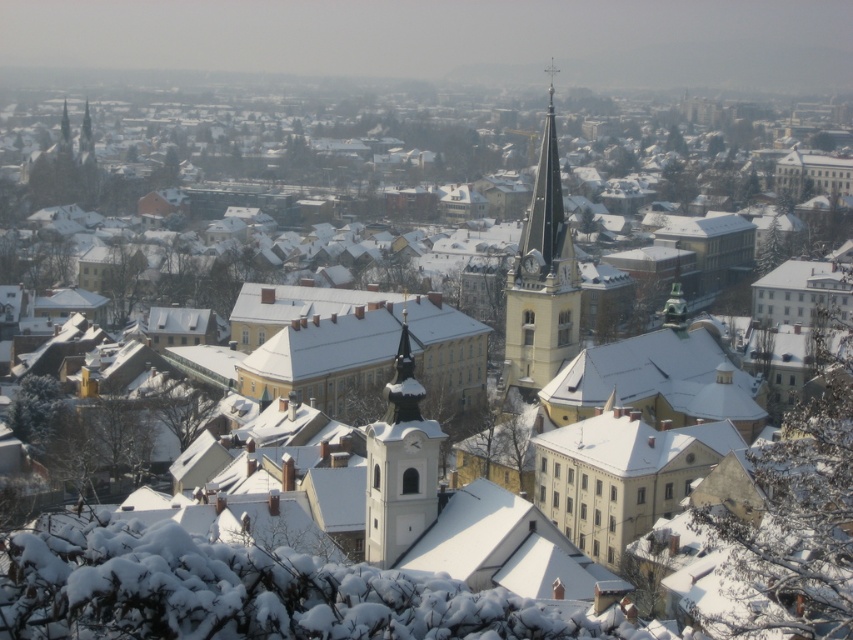
Between smooth white steeple at center and white stone clock tower at center, which one has more height?

With more height is smooth white steeple at center.

Can you confirm if smooth white steeple at center is bigger than white stone clock tower at center?

Correct, smooth white steeple at center is larger in size than white stone clock tower at center.

Between point (540, 252) and point (374, 493), which one is positioned in front?

Point (374, 493)

Where is `smooth white steeple at center`? The width and height of the screenshot is (853, 640). smooth white steeple at center is located at coordinates (543, 280).